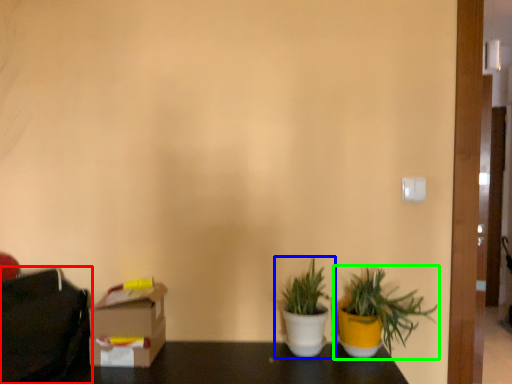
Question: Which object is the closest to the bag (highlighted by a red box)? Choose among these: houseplant (highlighted by a blue box) or houseplant (highlighted by a green box).

Choices:
 (A) houseplant
 (B) houseplant

Answer: (A)